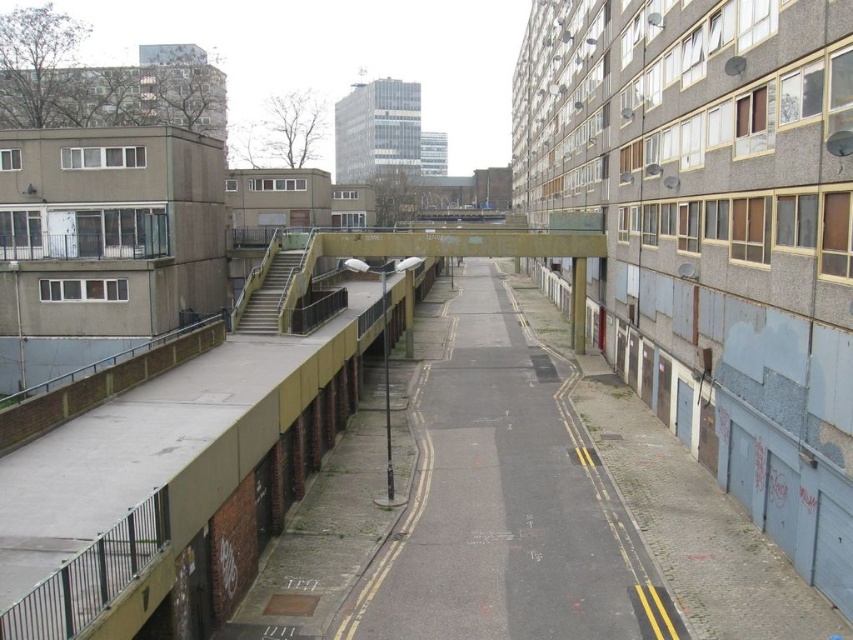
Question: Which point is closer to the camera?

Choices:
 (A) coord(445,488)
 (B) coord(239,328)

Answer: (A)

Question: Can you confirm if asphalt road at center is thinner than concrete staircase at center-left?

Choices:
 (A) yes
 (B) no

Answer: (B)

Question: Which object is farther from the camera taking this photo?

Choices:
 (A) asphalt road at center
 (B) concrete staircase at center-left

Answer: (B)

Question: Does asphalt road at center appear on the left side of concrete staircase at center-left?

Choices:
 (A) yes
 (B) no

Answer: (B)

Question: Is asphalt road at center bigger than concrete staircase at center-left?

Choices:
 (A) no
 (B) yes

Answer: (B)